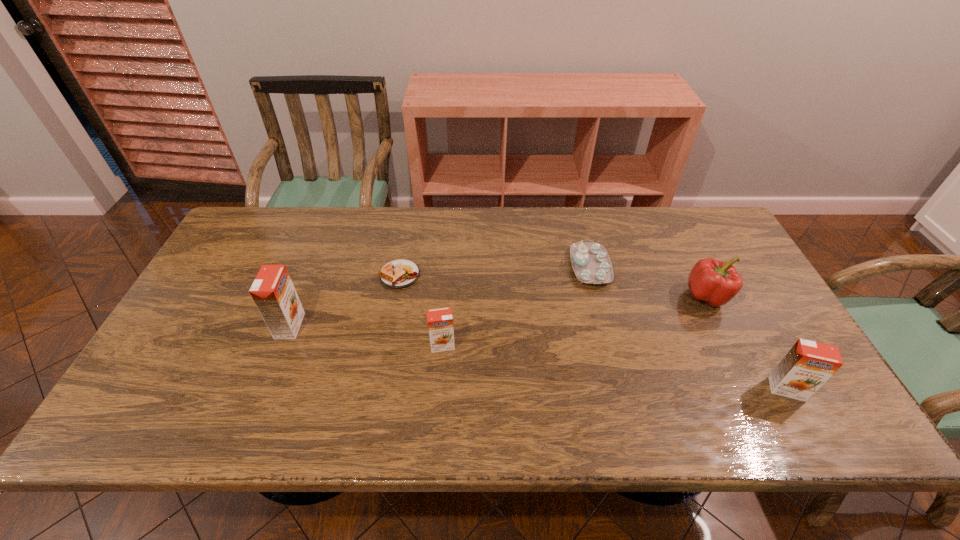
Where is `vacant area that lies between the shortest orange juice and the nearest object`? The image size is (960, 540). vacant area that lies between the shortest orange juice and the nearest object is located at coordinates (614, 367).

Where is `empty space that is in between the chinaware and the rightmost orange juice`? The height and width of the screenshot is (540, 960). empty space that is in between the chinaware and the rightmost orange juice is located at coordinates point(688,328).

Identify the location of free spot between the chinaware and the nearest object. (688, 328).

The height and width of the screenshot is (540, 960). In order to click on unoccupied area between the third object from right to left and the second tallest object in this screenshot , I will do `click(688, 328)`.

Find the location of `vacant area between the bell pepper and the second shortest orange juice`. vacant area between the bell pepper and the second shortest orange juice is located at coordinates (747, 342).

Where is `unoccupied position between the leftmost object and the third object from right to left`? unoccupied position between the leftmost object and the third object from right to left is located at coordinates 440,296.

Find the location of a particular element. free space between the second orange juice from left to right and the third object from right to left is located at coordinates (516, 306).

Locate an element on the screen. The height and width of the screenshot is (540, 960). vacant area that lies between the second object from left to right and the tallest object is located at coordinates (345, 300).

Locate which object is the second closest to the second orange juice from left to right. Please provide its 2D coordinates. Your answer should be formatted as a tuple, i.e. [(x, y)], where the tuple contains the x and y coordinates of a point satisfying the conditions above.

[(273, 292)]

Identify which object is located as the third nearest to the tallest orange juice. Please provide its 2D coordinates. Your answer should be formatted as a tuple, i.e. [(x, y)], where the tuple contains the x and y coordinates of a point satisfying the conditions above.

[(591, 263)]